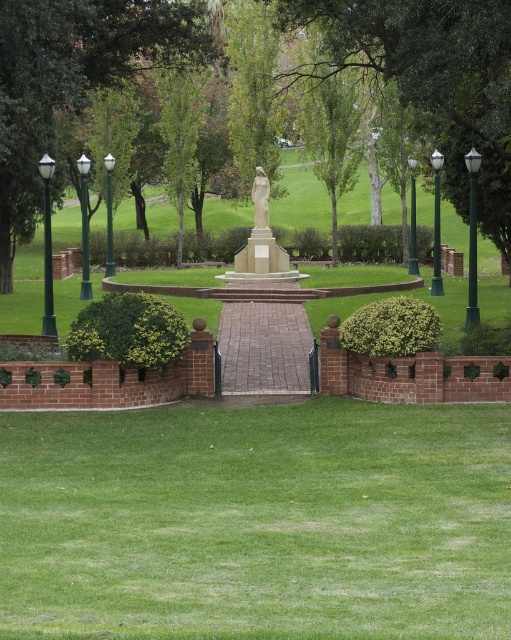
You are planning to place a new bench in the park. The bench requires a space wider than the green metal lamp post at upper center. Can the green leafy bush at center provide enough space for the bench?

The green leafy bush at center has a greater width than the green metal lamp post at upper center. Therefore, the space provided by the green leafy bush at center is sufficient for placing the bench requiring more width than the lamp post.

You are a gardener who needs to trim the green leafy hedge at center and the green metallic lamp post at right. Which object should you work on first if you want to start with the one that is physically above the other?

The green leafy hedge at center is positioned over the green metallic lamp post at right, so you should trim the green leafy hedge at center first since it is above the lamp post.

You are standing in the park and see both the green metal lamp post at left and the green glass lamp post at left. Which lamp post is nearer to you?

The green metal lamp post at left is closer to the viewer than the green glass lamp post at left.